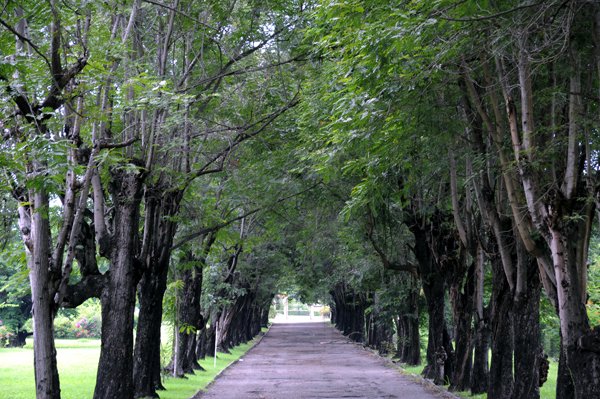
Where is `walk way`? The image size is (600, 399). walk way is located at coordinates (297, 375).